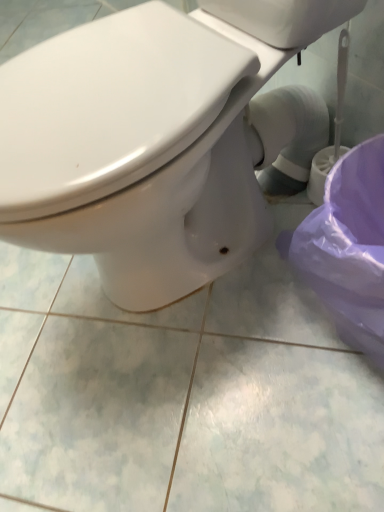
Where is `free space in front of white glossy toilet at center`? free space in front of white glossy toilet at center is located at coordinates (226, 402).